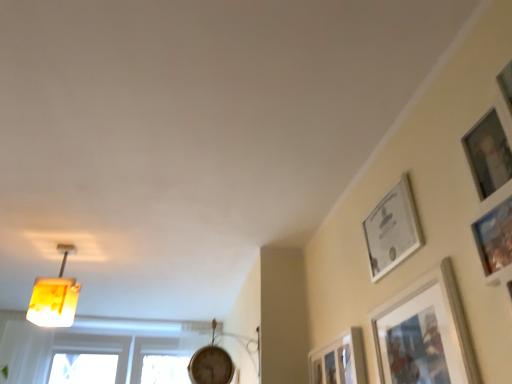
Locate an element on the screen. The height and width of the screenshot is (384, 512). matte silver picture frame at upper right, the third picture frame viewed from the left is located at coordinates (424, 333).

The height and width of the screenshot is (384, 512). I want to click on white glossy picture frame at upper right, the 2th picture frame positioned from the left, so click(392, 229).

Measure the distance between point (352, 370) and camera.

They are 1.54 meters apart.

Locate an element on the screen. The height and width of the screenshot is (384, 512). matte silver picture frame at upper right, the third picture frame viewed from the left is located at coordinates (424, 333).

Based on the photo, are matte silver picture frame at upper right, the third picture frame viewed from the left, and white glossy picture frame at upper right, the 2th picture frame positioned from the left, beside each other?

matte silver picture frame at upper right, the third picture frame viewed from the left, is not next to white glossy picture frame at upper right, the 2th picture frame positioned from the left, and they're not touching.

Is matte silver picture frame at upper right, which is the first picture frame in right-to-left order, in front of or behind white glossy picture frame at upper right, which is the 2th picture frame from right to left, in the image?

matte silver picture frame at upper right, which is the first picture frame in right-to-left order, is positioned closer to the viewer than white glossy picture frame at upper right, which is the 2th picture frame from right to left.

Considering the positions of point (456, 311) and point (390, 262), is point (456, 311) closer or farther from the camera than point (390, 262)?

Point (456, 311) appears to be closer to the viewer than point (390, 262).

From a real-world perspective, is matte silver picture frame at upper right, the third picture frame viewed from the left, above or below white glossy picture frame at upper right, which is the 2th picture frame from right to left?

In terms of real-world spatial position, matte silver picture frame at upper right, the third picture frame viewed from the left, is below white glossy picture frame at upper right, which is the 2th picture frame from right to left.

From the image's perspective, which is above, matte silver picture frame at lower right, which ranks as the 1th picture frame in left-to-right order, or white glossy picture frame at upper right, which is the 2th picture frame from right to left?

white glossy picture frame at upper right, which is the 2th picture frame from right to left, appears higher in the image.

Considering the positions of objects matte silver picture frame at lower right, which ranks as the 1th picture frame in left-to-right order, and white glossy picture frame at upper right, the 2th picture frame positioned from the left, in the image provided, who is more to the left, matte silver picture frame at lower right, which ranks as the 1th picture frame in left-to-right order, or white glossy picture frame at upper right, the 2th picture frame positioned from the left,?

Positioned to the left is matte silver picture frame at lower right, which ranks as the 1th picture frame in left-to-right order.

Which is correct: matte silver picture frame at lower right, the 3th picture frame when ordered from right to left, is inside white glossy picture frame at upper right, which is the 2th picture frame from right to left, or outside of it?

matte silver picture frame at lower right, the 3th picture frame when ordered from right to left, is spatially situated outside white glossy picture frame at upper right, which is the 2th picture frame from right to left.

Which object is more forward, matte silver picture frame at lower right, the 3th picture frame when ordered from right to left, or white glossy picture frame at upper right, which is the 2th picture frame from right to left?

white glossy picture frame at upper right, which is the 2th picture frame from right to left, is closer to the camera.

Is white glossy picture frame at upper right, which is the 2th picture frame from right to left, positioned far away from matte silver picture frame at upper right, which is the first picture frame in right-to-left order?

No, white glossy picture frame at upper right, which is the 2th picture frame from right to left, is in close proximity to matte silver picture frame at upper right, which is the first picture frame in right-to-left order.

Is point (372, 267) less distant than point (406, 367)?

That is False.

Does white glossy picture frame at upper right, the 2th picture frame positioned from the left, come behind matte silver picture frame at upper right, which is the first picture frame in right-to-left order?

Yes.

In the image, is matte silver picture frame at lower right, the 3th picture frame when ordered from right to left, positioned in front of or behind yellow translucent lampshade at upper left?

Visually, matte silver picture frame at lower right, the 3th picture frame when ordered from right to left, is located in front of yellow translucent lampshade at upper left.

How different are the orientations of matte silver picture frame at lower right, the 3th picture frame when ordered from right to left, and yellow translucent lampshade at upper left in degrees?

81.7 degrees separate the facing orientations of matte silver picture frame at lower right, the 3th picture frame when ordered from right to left, and yellow translucent lampshade at upper left.

Based on the photo, from a real-world perspective, is matte silver picture frame at lower right, the 3th picture frame when ordered from right to left, positioned above or below yellow translucent lampshade at upper left?

matte silver picture frame at lower right, the 3th picture frame when ordered from right to left, is below yellow translucent lampshade at upper left.

Is matte silver picture frame at lower right, which ranks as the 1th picture frame in left-to-right order, looking in the opposite direction of yellow translucent lampshade at upper left?

That's not correct — matte silver picture frame at lower right, which ranks as the 1th picture frame in left-to-right order, is not looking away from yellow translucent lampshade at upper left.

Is white glossy picture frame at upper right, the 2th picture frame positioned from the left, completely or partially outside of matte silver picture frame at lower right, which ranks as the 1th picture frame in left-to-right order?

white glossy picture frame at upper right, the 2th picture frame positioned from the left, is positioned outside matte silver picture frame at lower right, which ranks as the 1th picture frame in left-to-right order.

Which object is wider, white glossy picture frame at upper right, which is the 2th picture frame from right to left, or matte silver picture frame at lower right, which ranks as the 1th picture frame in left-to-right order?

matte silver picture frame at lower right, which ranks as the 1th picture frame in left-to-right order, is wider.

Based on the photo, from the image's perspective, would you say white glossy picture frame at upper right, the 2th picture frame positioned from the left, is positioned over matte silver picture frame at lower right, the 3th picture frame when ordered from right to left?

Yes, from the image's perspective, white glossy picture frame at upper right, the 2th picture frame positioned from the left, is above matte silver picture frame at lower right, the 3th picture frame when ordered from right to left.

Is point (370, 215) closer or farther from the camera than point (343, 361)?

Point (370, 215) is closer to the camera than point (343, 361).

Considering the sizes of yellow translucent lampshade at upper left and matte silver picture frame at upper right, the third picture frame viewed from the left, in the image, is yellow translucent lampshade at upper left wider or thinner than matte silver picture frame at upper right, the third picture frame viewed from the left,?

yellow translucent lampshade at upper left is wider than matte silver picture frame at upper right, the third picture frame viewed from the left.

Which object is further away from the camera, yellow translucent lampshade at upper left or matte silver picture frame at upper right, the third picture frame viewed from the left?

yellow translucent lampshade at upper left is further from the camera.

Is yellow translucent lampshade at upper left facing towards matte silver picture frame at upper right, the third picture frame viewed from the left?

No, yellow translucent lampshade at upper left is not facing towards matte silver picture frame at upper right, the third picture frame viewed from the left.

From the image's perspective, which is above, yellow translucent lampshade at upper left or matte silver picture frame at upper right, which is the first picture frame in right-to-left order?

matte silver picture frame at upper right, which is the first picture frame in right-to-left order, appears higher in the image.

From a real-world perspective, is matte silver picture frame at upper right, the third picture frame viewed from the left, positioned above or below matte silver picture frame at lower right, the 3th picture frame when ordered from right to left?

In terms of real-world spatial position, matte silver picture frame at upper right, the third picture frame viewed from the left, is below matte silver picture frame at lower right, the 3th picture frame when ordered from right to left.

Considering the relative sizes of matte silver picture frame at upper right, the third picture frame viewed from the left, and matte silver picture frame at lower right, which ranks as the 1th picture frame in left-to-right order, in the image provided, is matte silver picture frame at upper right, the third picture frame viewed from the left, thinner than matte silver picture frame at lower right, which ranks as the 1th picture frame in left-to-right order,?

Correct, the width of matte silver picture frame at upper right, the third picture frame viewed from the left, is less than that of matte silver picture frame at lower right, which ranks as the 1th picture frame in left-to-right order.

Does matte silver picture frame at upper right, which is the first picture frame in right-to-left order, have a smaller size compared to matte silver picture frame at lower right, the 3th picture frame when ordered from right to left?

Actually, matte silver picture frame at upper right, which is the first picture frame in right-to-left order, might be larger than matte silver picture frame at lower right, the 3th picture frame when ordered from right to left.

From the image's perspective, is matte silver picture frame at upper right, the third picture frame viewed from the left, below matte silver picture frame at lower right, the 3th picture frame when ordered from right to left?

No, from the image's perspective, matte silver picture frame at upper right, the third picture frame viewed from the left, is not beneath matte silver picture frame at lower right, the 3th picture frame when ordered from right to left.

Locate an element on the screen. The width and height of the screenshot is (512, 384). picture frame that appears above the matte silver picture frame at upper right, which is the first picture frame in right-to-left order (from the image's perspective) is located at coordinates (392, 229).

From the image's perspective, count 2nd picture frames downward from the white glossy picture frame at upper right, which is the 2th picture frame from right to left, and point to it. Please provide its 2D coordinates.

[(339, 360)]

Estimate the real-world distances between objects in this image. Which object is closer to white glossy picture frame at upper right, the 2th picture frame positioned from the left, matte silver picture frame at lower right, the 3th picture frame when ordered from right to left, or matte silver picture frame at upper right, which is the first picture frame in right-to-left order?

matte silver picture frame at upper right, which is the first picture frame in right-to-left order, is positioned closer to the anchor white glossy picture frame at upper right, the 2th picture frame positioned from the left.

Looking at the image, which one is located closer to yellow translucent lampshade at upper left, matte silver picture frame at upper right, the third picture frame viewed from the left, or white glossy picture frame at upper right, the 2th picture frame positioned from the left?

white glossy picture frame at upper right, the 2th picture frame positioned from the left, is positioned closer to the anchor yellow translucent lampshade at upper left.

Based on the photo, from the image, which object appears to be farther from matte silver picture frame at lower right, which ranks as the 1th picture frame in left-to-right order, yellow translucent lampshade at upper left or matte silver picture frame at upper right, the third picture frame viewed from the left?

yellow translucent lampshade at upper left.

Based on their spatial positions, is white glossy picture frame at upper right, which is the 2th picture frame from right to left, or yellow translucent lampshade at upper left closer to matte silver picture frame at upper right, which is the first picture frame in right-to-left order?

white glossy picture frame at upper right, which is the 2th picture frame from right to left, is positioned closer to the anchor matte silver picture frame at upper right, which is the first picture frame in right-to-left order.

Looking at the image, which one is located further to matte silver picture frame at lower right, which ranks as the 1th picture frame in left-to-right order, white glossy picture frame at upper right, which is the 2th picture frame from right to left, or matte silver picture frame at upper right, the third picture frame viewed from the left?

The object further to matte silver picture frame at lower right, which ranks as the 1th picture frame in left-to-right order, is white glossy picture frame at upper right, which is the 2th picture frame from right to left.

From the image, which object appears to be nearer to yellow translucent lampshade at upper left, matte silver picture frame at upper right, which is the first picture frame in right-to-left order, or matte silver picture frame at lower right, which ranks as the 1th picture frame in left-to-right order?

matte silver picture frame at lower right, which ranks as the 1th picture frame in left-to-right order.

When comparing their distances from white glossy picture frame at upper right, which is the 2th picture frame from right to left, does matte silver picture frame at lower right, the 3th picture frame when ordered from right to left, or yellow translucent lampshade at upper left seem closer?

Among the two, matte silver picture frame at lower right, the 3th picture frame when ordered from right to left, is located nearer to white glossy picture frame at upper right, which is the 2th picture frame from right to left.

Looking at the image, which one is located closer to yellow translucent lampshade at upper left, matte silver picture frame at lower right, the 3th picture frame when ordered from right to left, or white glossy picture frame at upper right, which is the 2th picture frame from right to left?

Based on the image, matte silver picture frame at lower right, the 3th picture frame when ordered from right to left, appears to be nearer to yellow translucent lampshade at upper left.

I want to click on picture frame situated between yellow translucent lampshade at upper left and white glossy picture frame at upper right, which is the 2th picture frame from right to left, from left to right, so click(339, 360).

The image size is (512, 384). I want to click on picture frame between white glossy picture frame at upper right, the 2th picture frame positioned from the left, and matte silver picture frame at lower right, which ranks as the 1th picture frame in left-to-right order, in the up-down direction, so click(x=424, y=333).